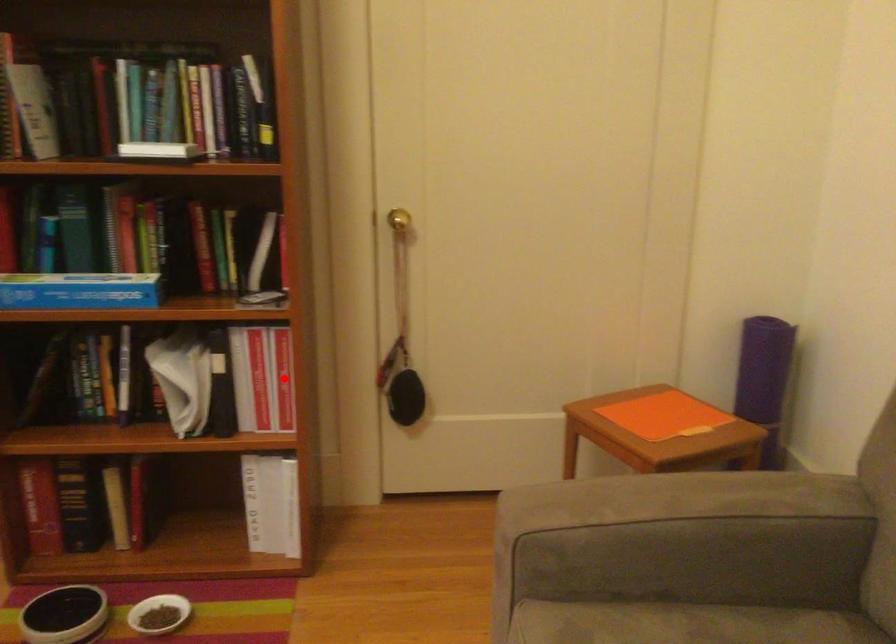
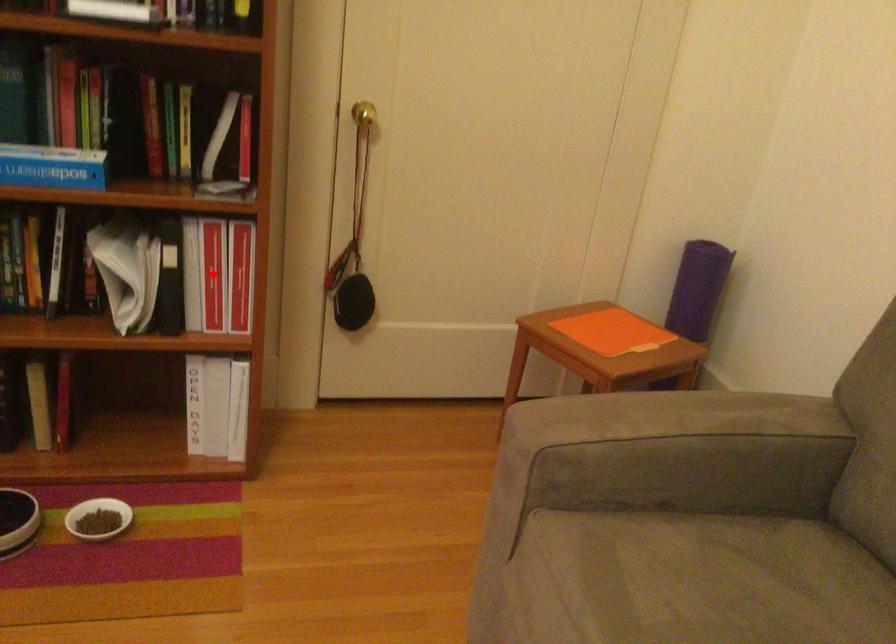
I am providing you with two images of the same scene from different viewpoints. A red point is marked on the first image and another point is marked on the second image. Do the highlighted points in image1 and image2 indicate the same real-world spot?

No